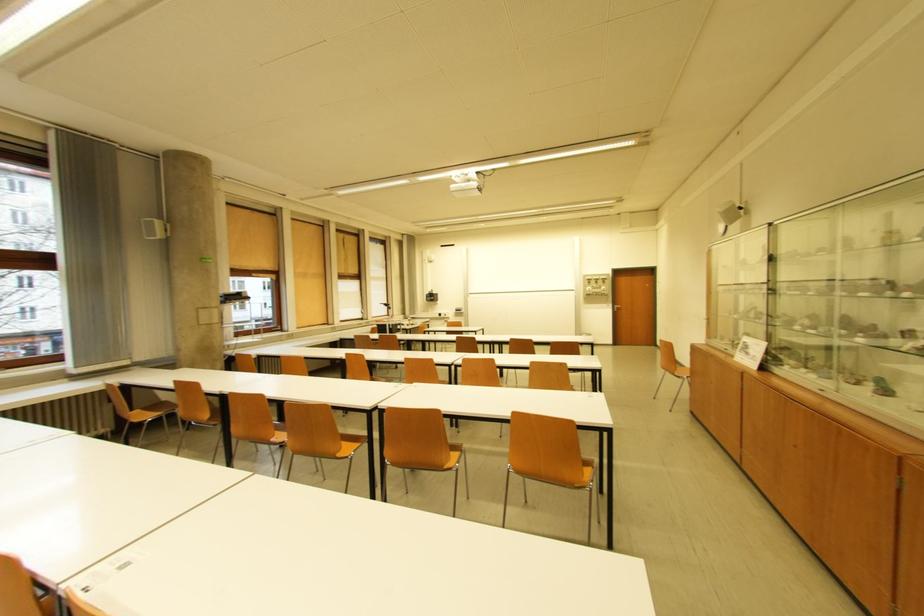
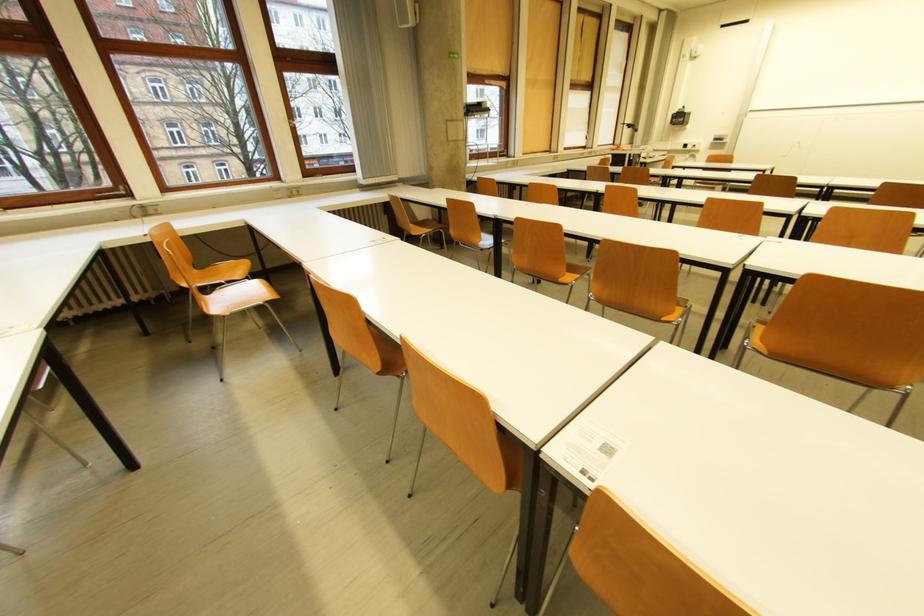
Find the pixel in the second image that matches pixel 177 387 in the first image.

(451, 206)